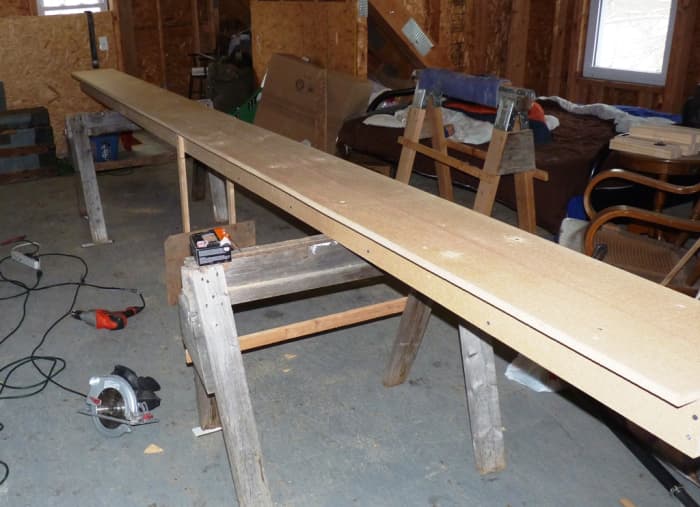
The height and width of the screenshot is (507, 700). I want to click on garage floor, so click(321, 464).